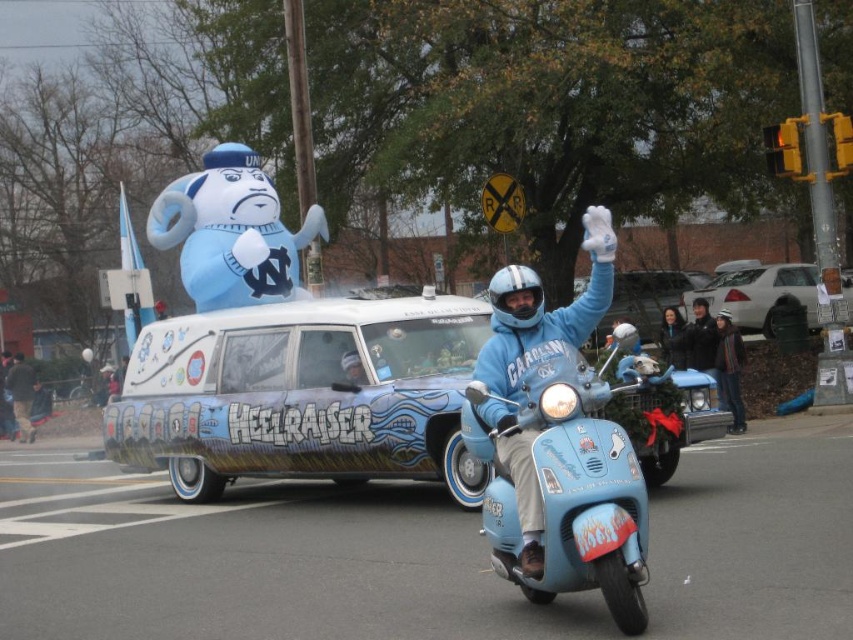
Question: Can you confirm if light blue painted hearse at center is positioned to the left of silver metallic sedan at right?

Choices:
 (A) yes
 (B) no

Answer: (A)

Question: Which object is closer to the camera taking this photo?

Choices:
 (A) light blue painted hearse at center
 (B) light blue matte hearse at center
 (C) brown leather jacket at lower left
 (D) dark blue jacket at center

Answer: (A)

Question: Considering the relative positions of dark blue jacket at center and blue fabric jacket at center in the image provided, where is dark blue jacket at center located with respect to blue fabric jacket at center?

Choices:
 (A) below
 (B) above

Answer: (B)

Question: Which is nearer to the light blue painted hearse at center?

Choices:
 (A) denim jacket at lower right
 (B) blue fabric jacket at center
 (C) silver metallic sedan at right

Answer: (A)

Question: Is light blue painted hearse at center positioned at the back of dark blue jacket at center?

Choices:
 (A) yes
 (B) no

Answer: (B)

Question: Considering the real-world distances, which object is farthest from the blue fabric jacket at center?

Choices:
 (A) blue matte helmet at center
 (B) light blue matte scooter at center

Answer: (A)